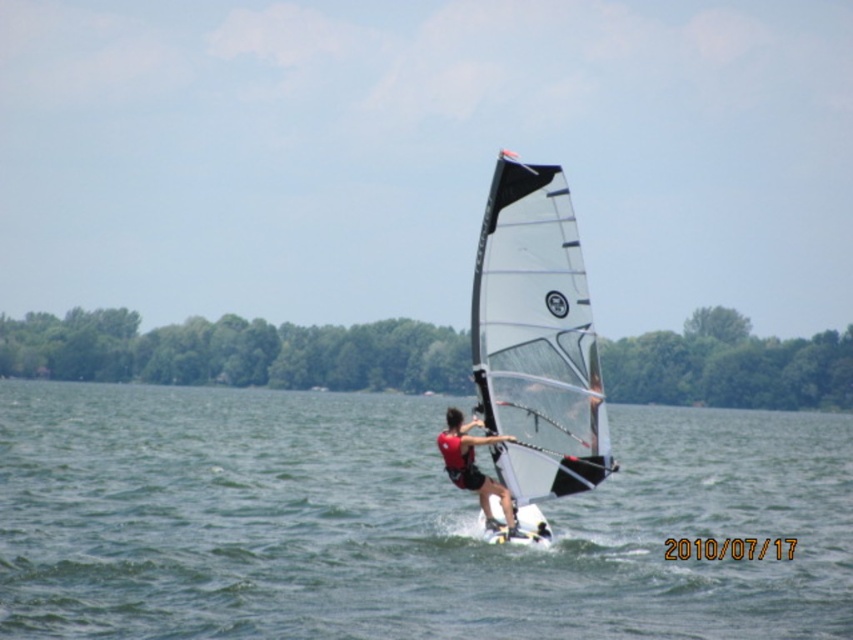
Question: Which of the following is the farthest from the observer?

Choices:
 (A) clear water at center
 (B) red matte life vest at center
 (C) transparent plastic sail at center

Answer: (B)

Question: Estimate the real-world distances between objects in this image. Which object is closer to the transparent plastic sail at center?

Choices:
 (A) clear water at center
 (B) red matte life vest at center

Answer: (B)

Question: Can you confirm if clear water at center is positioned below red matte life vest at center?

Choices:
 (A) no
 (B) yes

Answer: (B)

Question: Does clear water at center appear under red matte life vest at center?

Choices:
 (A) no
 (B) yes

Answer: (B)

Question: Which object is positioned closest to the clear water at center?

Choices:
 (A) transparent plastic sail at center
 (B) red matte life vest at center

Answer: (A)

Question: In this image, where is transparent plastic sail at center located relative to red matte life vest at center?

Choices:
 (A) left
 (B) right

Answer: (B)